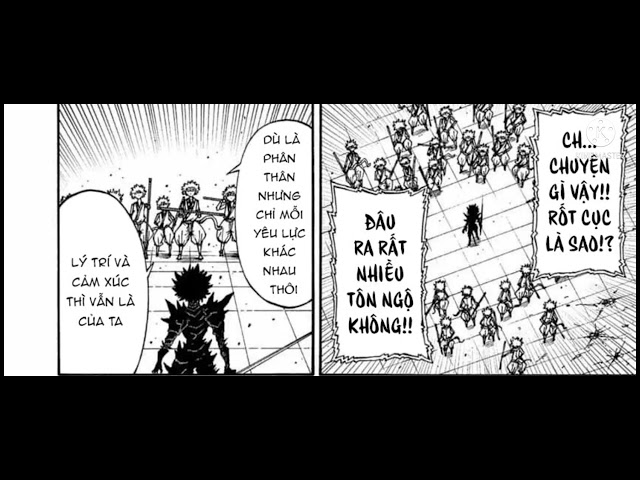
This screenshot has width=640, height=480. What are the coordinates of `floor` in the screenshot? It's located at (243, 321).